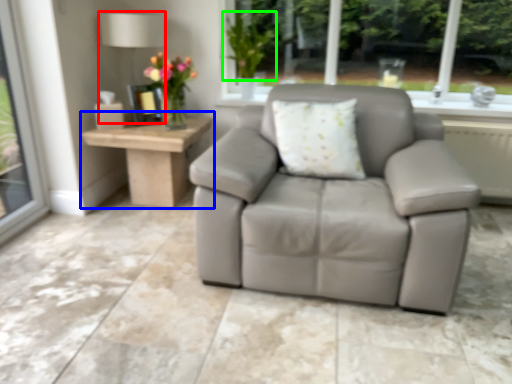
Question: Considering the real-world distances, which object is farthest from lamp (highlighted by a red box)? table (highlighted by a blue box) or plant (highlighted by a green box)?

Choices:
 (A) table
 (B) plant

Answer: (A)